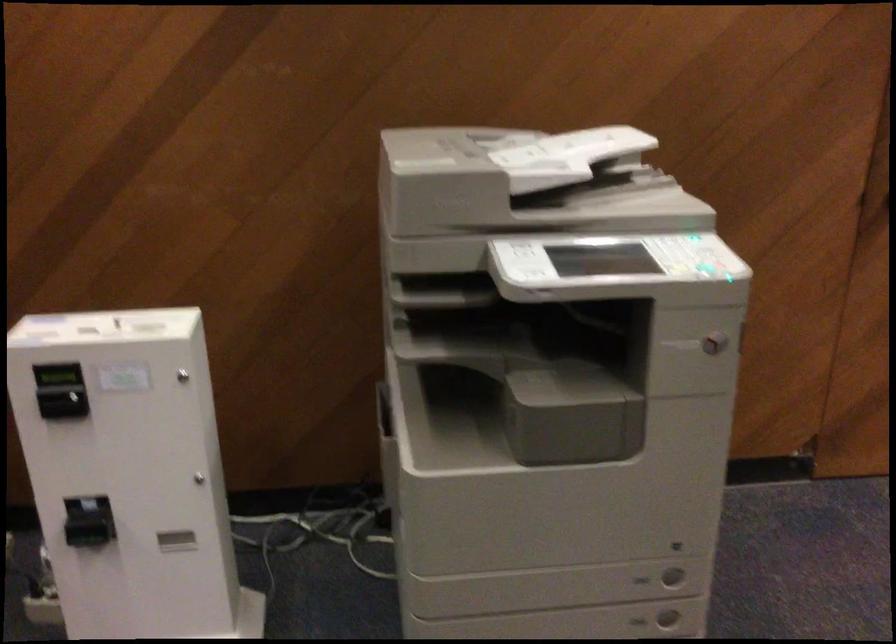
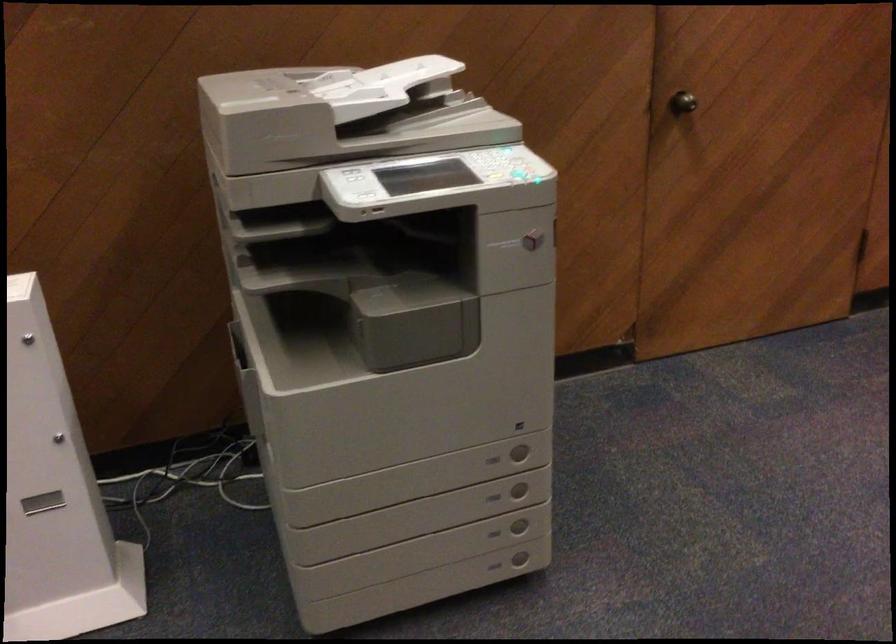
The point at [523,247] is marked in the first image. Where is the corresponding point in the second image?

(354, 175)